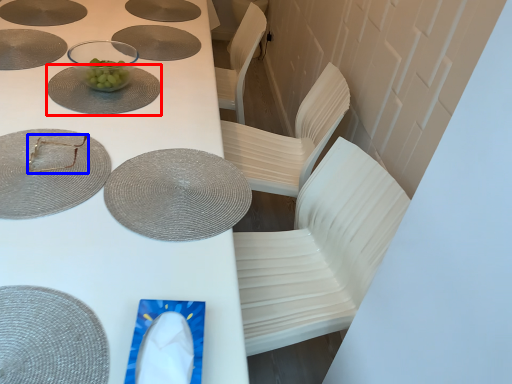
Question: Among these objects, which one is farthest to the camera, glass plate (highlighted by a red box) or tableware (highlighted by a blue box)?

Choices:
 (A) glass plate
 (B) tableware

Answer: (A)